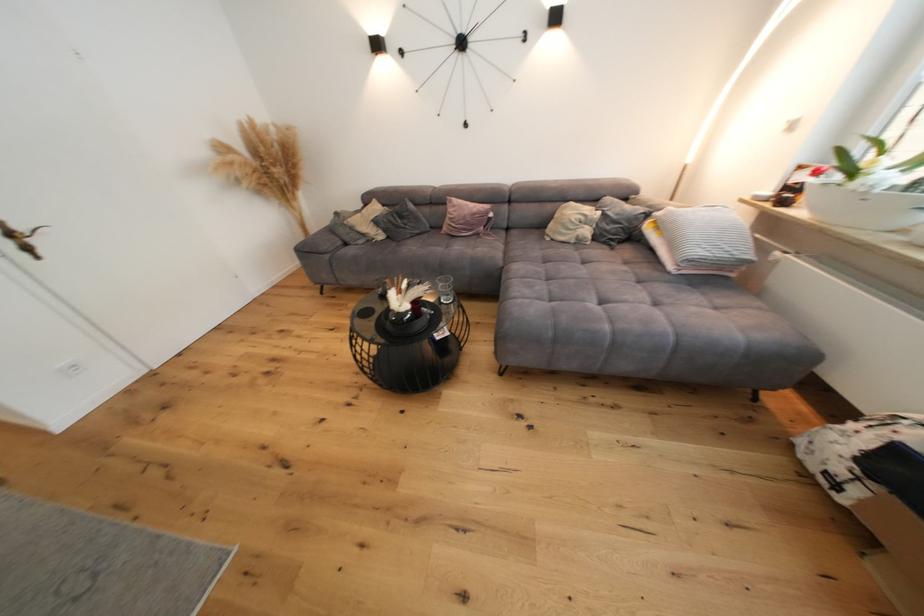
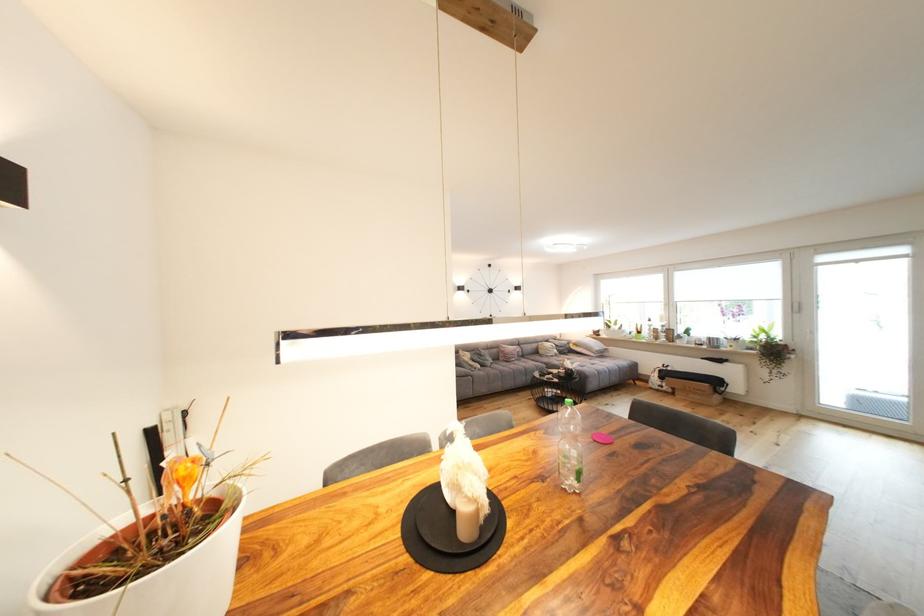
The point at (387, 238) is marked in the first image. Where is the corresponding point in the second image?

(485, 368)